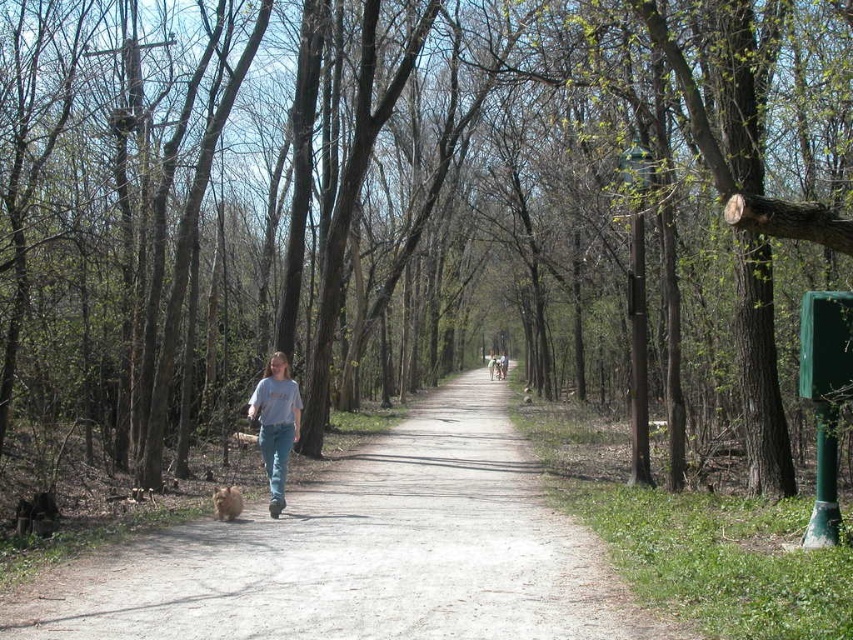
Question: Does dirt path at center have a lesser width compared to light blue jeans at center?

Choices:
 (A) no
 (B) yes

Answer: (A)

Question: Where is dirt path at center located in relation to light blue jeans at center in the image?

Choices:
 (A) left
 (B) right

Answer: (B)

Question: Which of the following is the closest to the observer?

Choices:
 (A) dirt path at center
 (B) light blue jeans at center

Answer: (A)

Question: Does dirt path at center appear on the right side of light blue jeans at center?

Choices:
 (A) yes
 (B) no

Answer: (A)